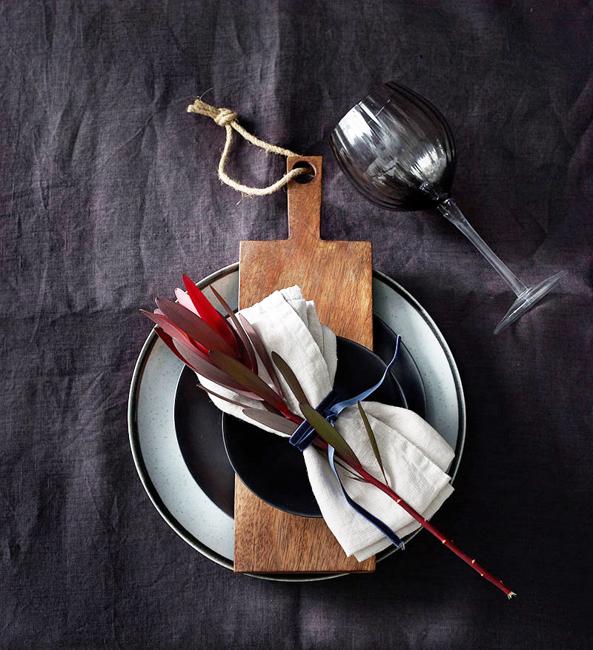
The height and width of the screenshot is (650, 593). Find the location of `stem of glass`. stem of glass is located at coordinates (471, 235).